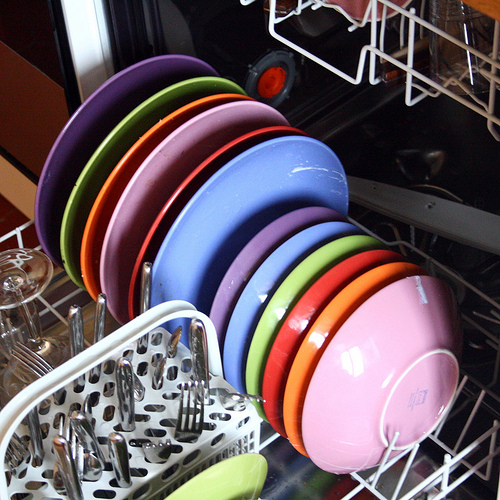
At what (x,y) coordinates should I click in order to perform the action: click on plate. Please return your answer as a coordinate pair (x, y). The height and width of the screenshot is (500, 500). Looking at the image, I should click on (110, 96), (133, 122), (151, 136), (161, 146), (195, 176), (241, 202).